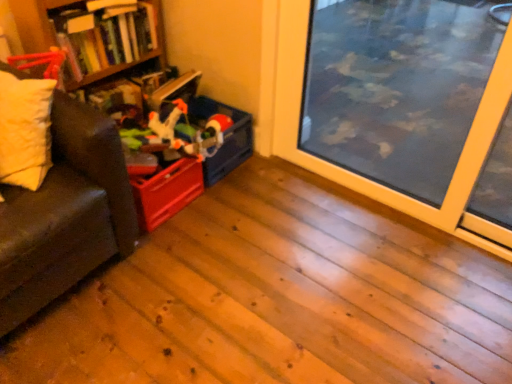
Question: Is point (359, 69) closer or farther from the camera than point (246, 142)?

Choices:
 (A) farther
 (B) closer

Answer: (A)

Question: From the image's perspective, is transparent glass window screen at center right located above or below matte plastic storage box at center-left?

Choices:
 (A) below
 (B) above

Answer: (B)

Question: Which object is the farthest from the transparent glass window screen at center right?

Choices:
 (A) matte plastic storage box at center-left
 (B) soft yellow pillow at left
 (C) wooden bookshelf at upper left

Answer: (B)

Question: Which object is positioned farthest from the transparent glass window screen at center right?

Choices:
 (A) soft yellow pillow at left
 (B) wooden bookshelf at upper left
 (C) matte plastic storage box at center-left

Answer: (A)